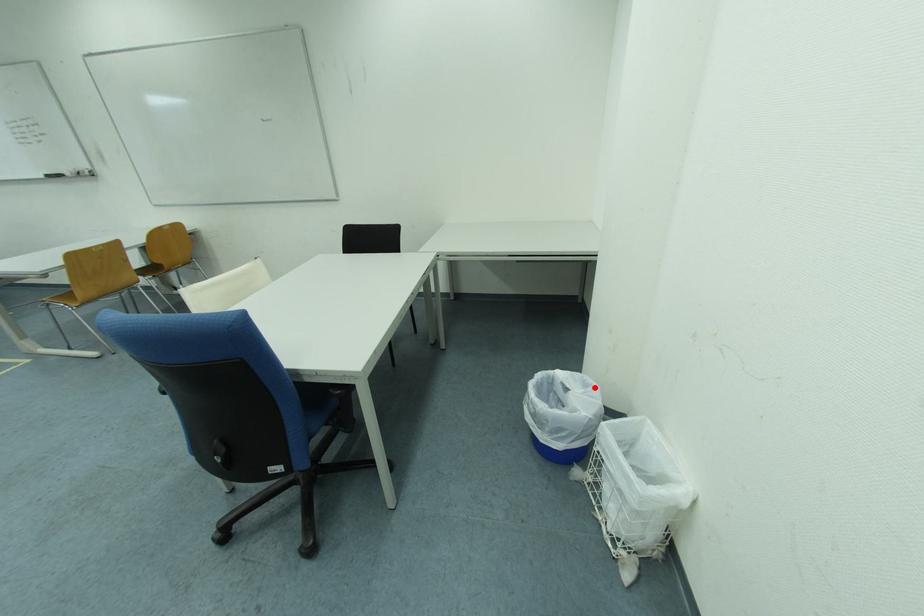
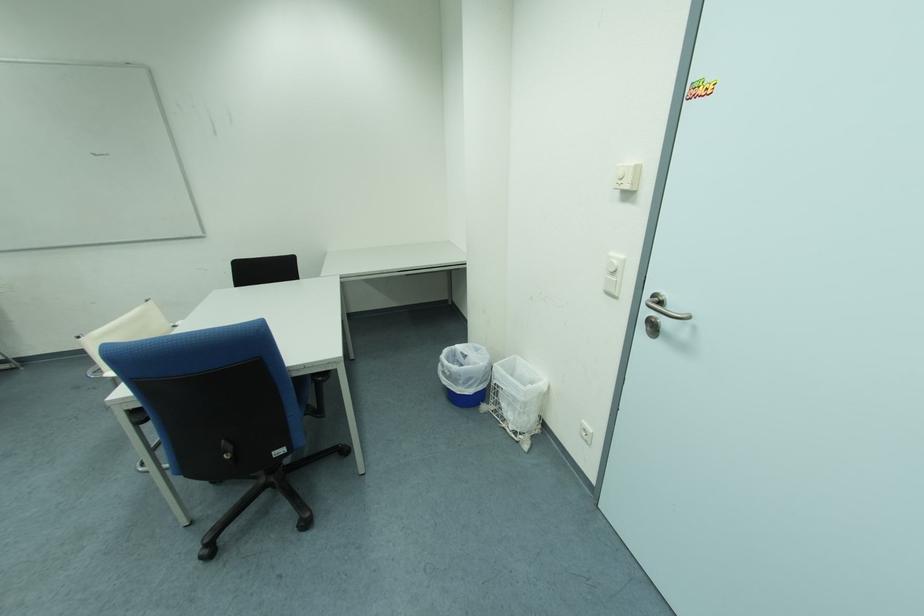
Locate, in the second image, the point that corresponds to the highlighted location in the first image.

(485, 352)